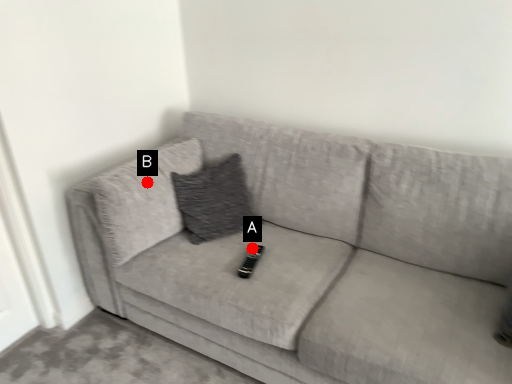
Question: Two points are circled on the image, labeled by A and B beside each circle. Which of the following is the closest to the observer?

Choices:
 (A) A is closer
 (B) B is closer

Answer: (A)